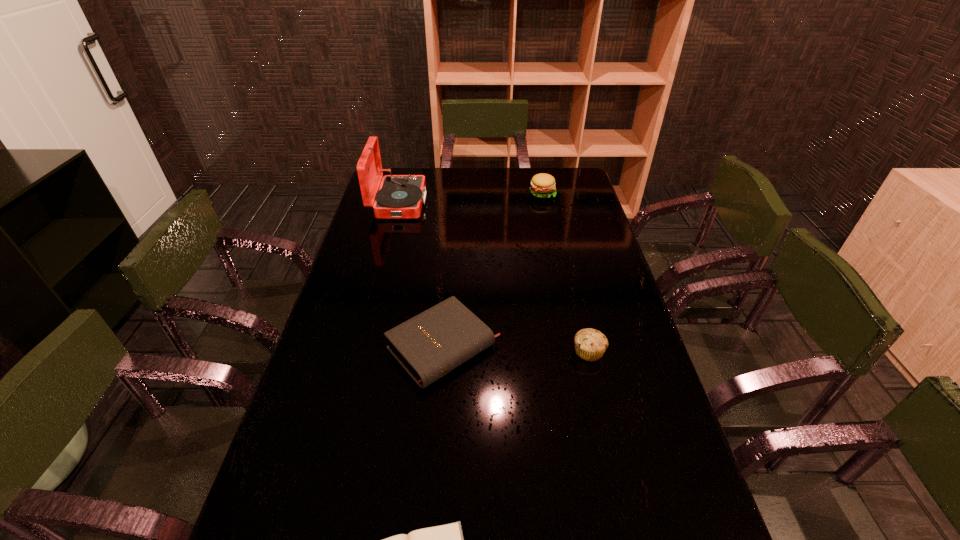
Identify the location of free space that satisfies the following two spatial constraints: 1. on the front-facing side of the phonograph_record; 2. on the left side of the muffin. (360, 352).

The height and width of the screenshot is (540, 960). What are the coordinates of `free region that satisfies the following two spatial constraints: 1. on the front-facing side of the muffin; 2. on the right side of the tallest object` in the screenshot? It's located at (360, 352).

This screenshot has width=960, height=540. In order to click on vacant point that satisfies the following two spatial constraints: 1. on the front-facing side of the fourth tallest object; 2. on the right side of the tallest object in this screenshot , I will do `click(361, 348)`.

At what (x,y) coordinates should I click in order to perform the action: click on free space in the image that satisfies the following two spatial constraints: 1. on the back side of the hamburger; 2. on the right side of the taller Bible. Please return your answer as a coordinate pair (x, y). The height and width of the screenshot is (540, 960). Looking at the image, I should click on pyautogui.click(x=456, y=193).